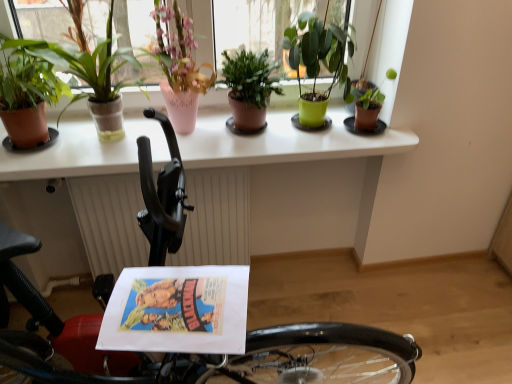
Question: Is point (175, 23) positioned closer to the camera than point (304, 339)?

Choices:
 (A) closer
 (B) farther

Answer: (B)

Question: Is pink ceramic vase at upper left, which appears as the 4th houseplant when viewed from the right, to the left or to the right of black rubber bicycle at lower left in the image?

Choices:
 (A) left
 (B) right

Answer: (A)

Question: Which is farther from the green matte plant at center, the 4th houseplant positioned from the left?

Choices:
 (A) white textured radiator at center
 (B) white glossy counter top at upper center
 (C) terracotta pot plant at left, which appears as the 2th houseplant when viewed from the left
 (D) green matte plant at upper right, marked as the 1th houseplant in a right-to-left arrangement
 (E) matte brown pot at left, arranged as the 6th houseplant when viewed from the right

Answer: (E)

Question: Which object is positioned farthest from the white glossy counter top at upper center?

Choices:
 (A) pink ceramic vase at upper left, the third houseplant positioned from the left
 (B) black rubber bicycle at lower left
 (C) white textured radiator at center
 (D) green matte plant at upper right, marked as the 1th houseplant in a right-to-left arrangement
 (E) terracotta pot plant at left, the 5th houseplant when ordered from right to left

Answer: (B)